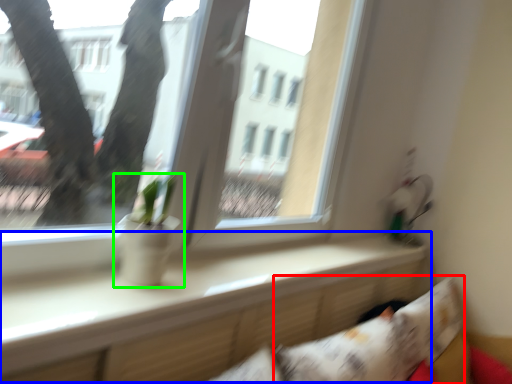
Question: Considering the real-world distances, which object is closest to pillow (highlighted by a red box)? window sill (highlighted by a blue box) or houseplant (highlighted by a green box).

Choices:
 (A) window sill
 (B) houseplant

Answer: (A)